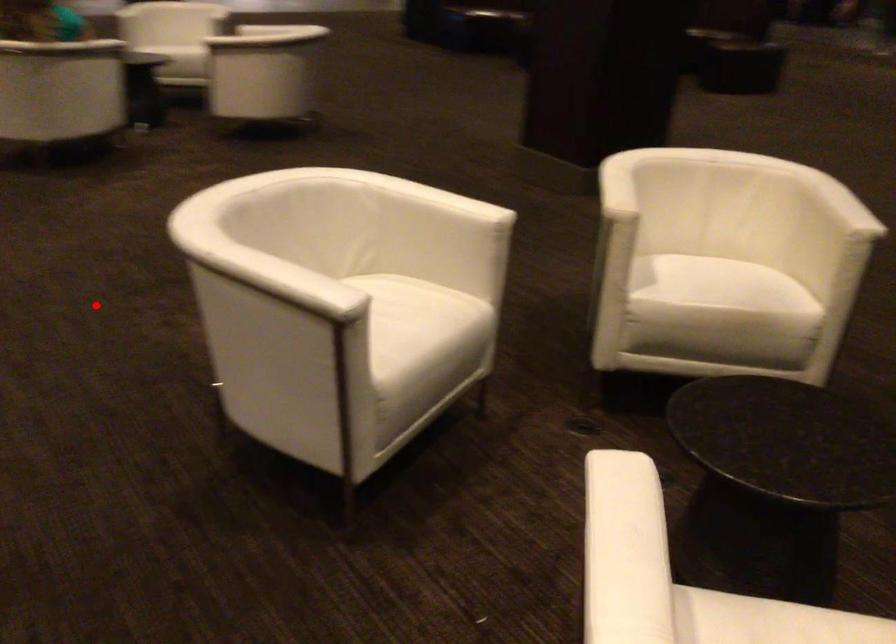
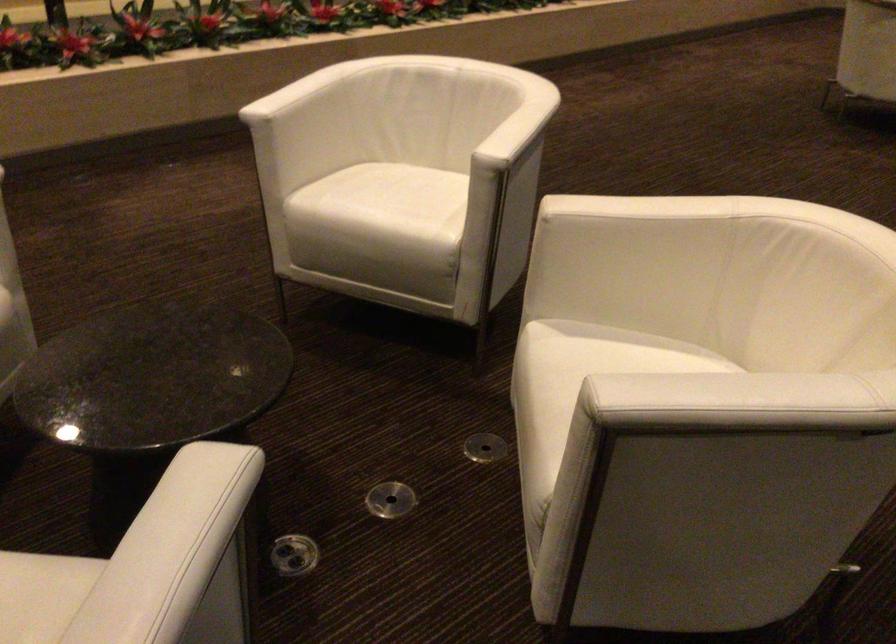
Question: I am providing you with two images of the same scene from different viewpoints. In image1, a red point is highlighted. Considering the same 3D point in image2, which of the following is correct?

Choices:
 (A) It is closer
 (B) It is farther

Answer: (B)